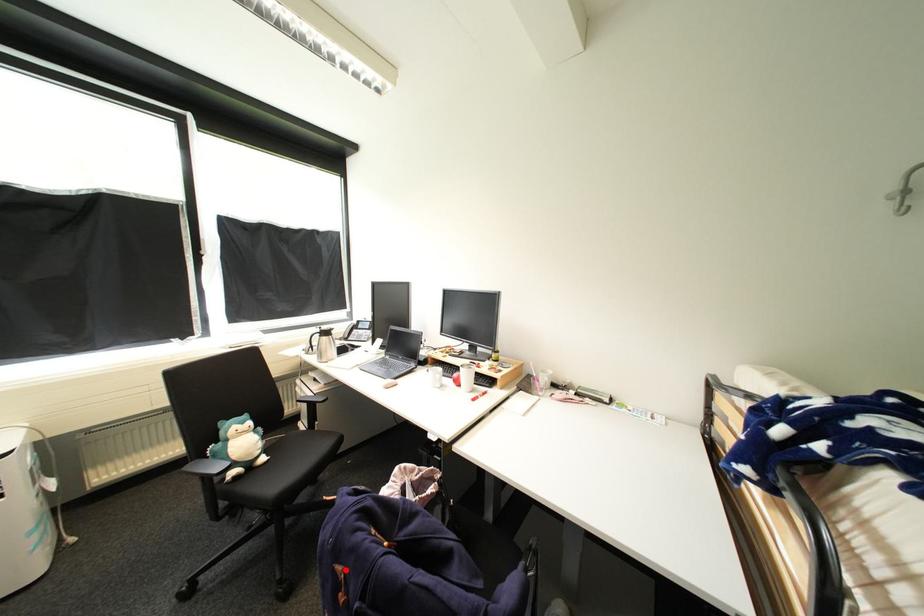
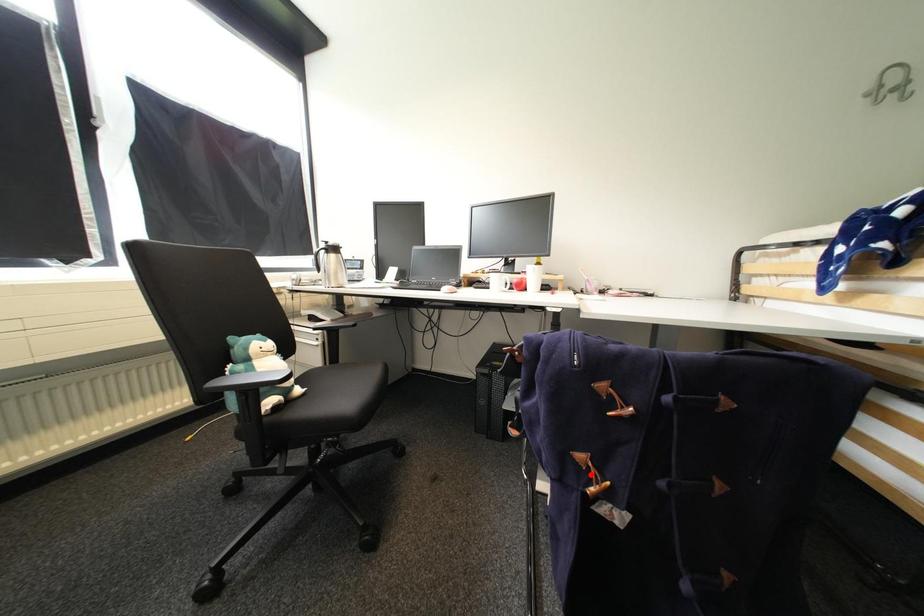
I am providing you with two images of the same scene from different viewpoints. A red point is marked on the first image and another point is marked on the second image. Is the marked point in image1 the same physical position as the marked point in image2?

No